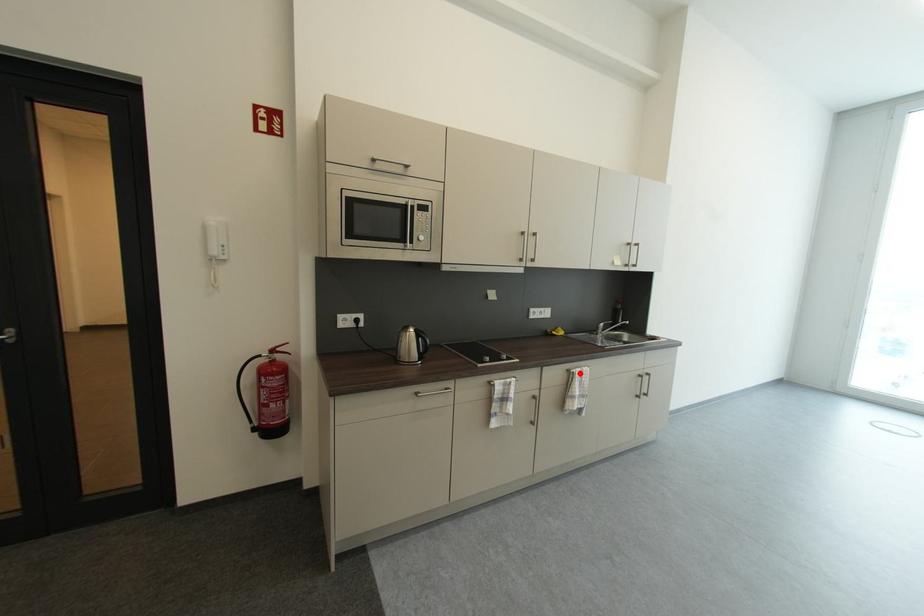
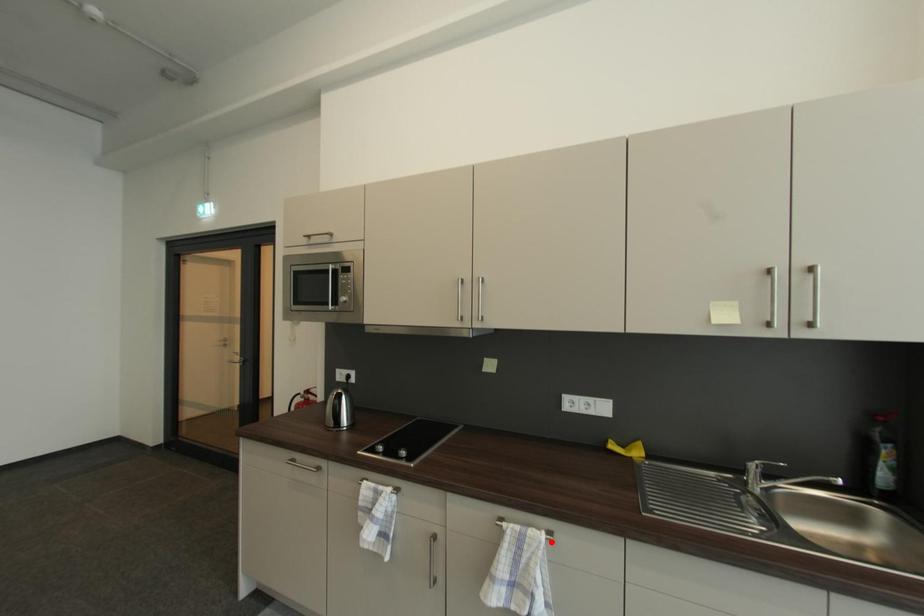
I am providing you with two images of the same scene from different viewpoints. A red point is marked on the first image and another point is marked on the second image. Is the marked point in image1 the same physical position as the marked point in image2?

No